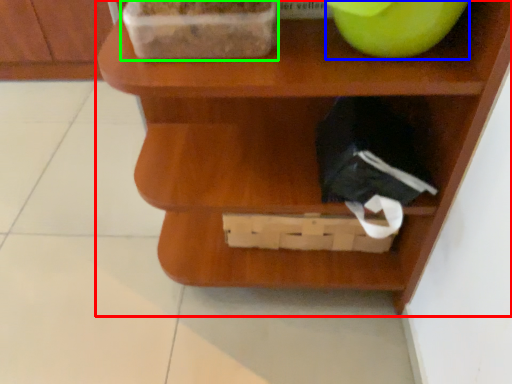
Question: Considering the real-world distances, which object is closest to shelf (highlighted by a red box)? apple (highlighted by a blue box) or wide (highlighted by a green box).

Choices:
 (A) apple
 (B) wide

Answer: (B)